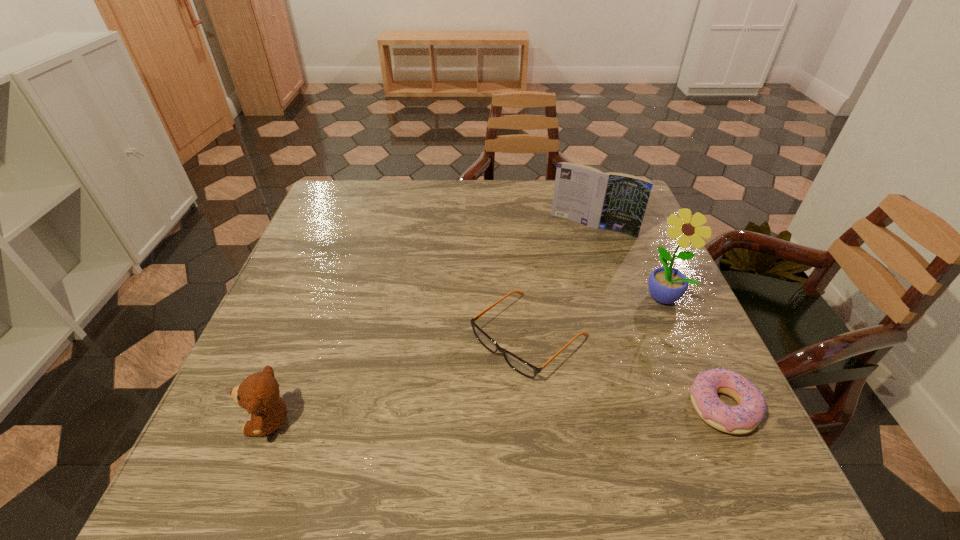
Identify the location of vacant spot on the desktop that is between the teddy bear and the doughnut and is positioned on the front-facing side of the sunflower. Image resolution: width=960 pixels, height=540 pixels. (556, 412).

Find the location of a particular element. The height and width of the screenshot is (540, 960). free space on the desktop that is between the leftmost object and the doughnut and is positioned on the front cover of the farthest object is located at coordinates (495, 414).

Where is `free spot on the desktop that is between the third tallest object and the doughnut and is positioned on the front-facing side of the spectacles`? free spot on the desktop that is between the third tallest object and the doughnut and is positioned on the front-facing side of the spectacles is located at coordinates (437, 416).